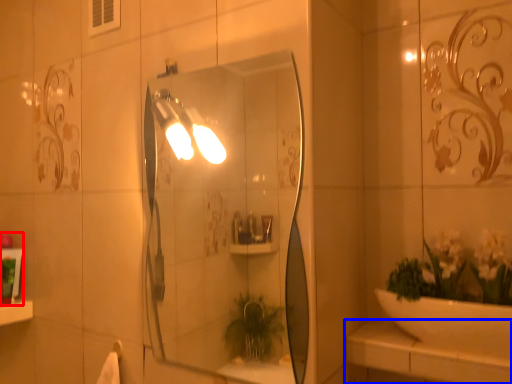
Question: Which of the following is the closest to the observer, toiletry (highlighted by a red box) or counter top (highlighted by a blue box)?

Choices:
 (A) toiletry
 (B) counter top

Answer: (B)